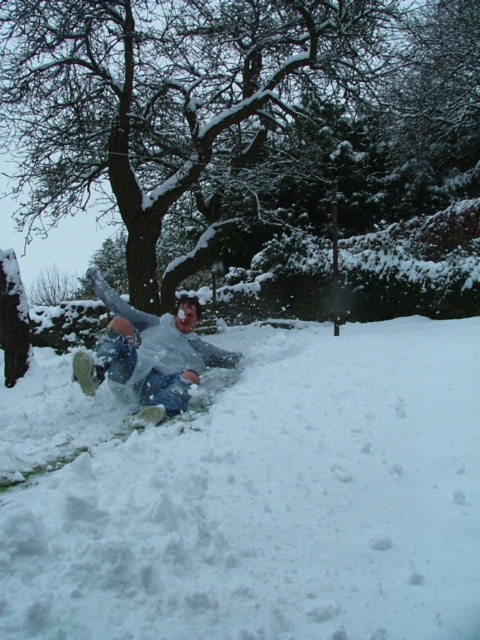
You are standing at the bottom of the snow hill and want to throw a snowball to hit both point [300,508] and point [194,99]. Which point should you aim for first if you want to hit them in order from closest to farthest?

You should aim for point [300,508] first because it is closer to you than point [194,99], so you can hit them in order from closest to farthest.

You are standing at the bottom of the snow hill and want to reach the white fluffy snow at center marked by point (x=256, y=497). Which direction should you move in to get there?

The white fluffy snow at center is located at point (x=256, y=497), so you should move towards the center of the image to reach it.